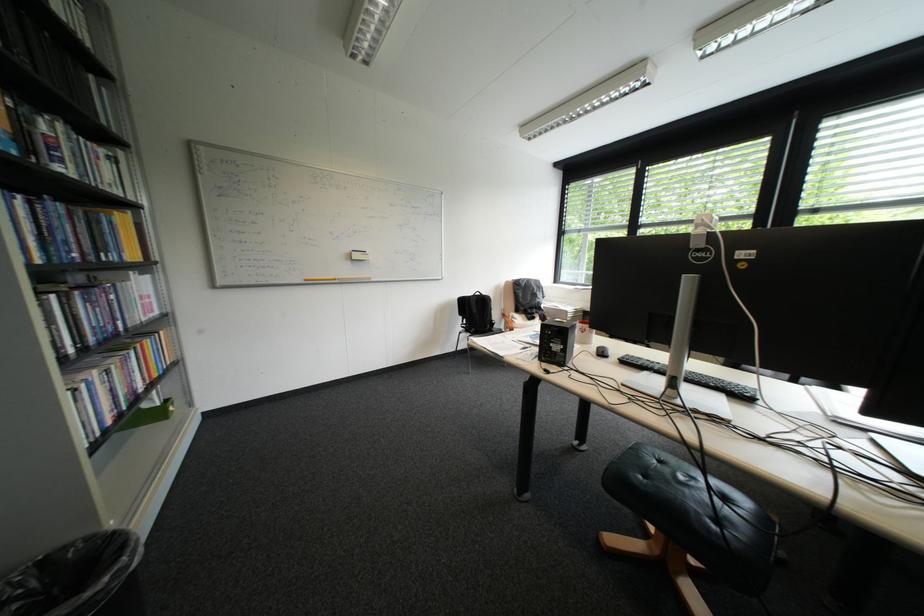
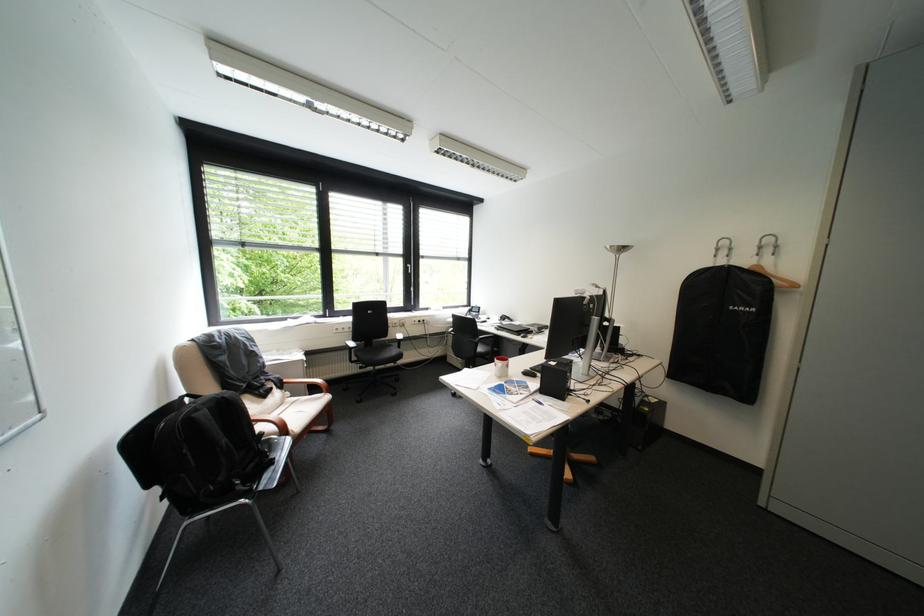
Where in the second image is the point corresponding to the point at 496,297 from the first image?

(236, 398)